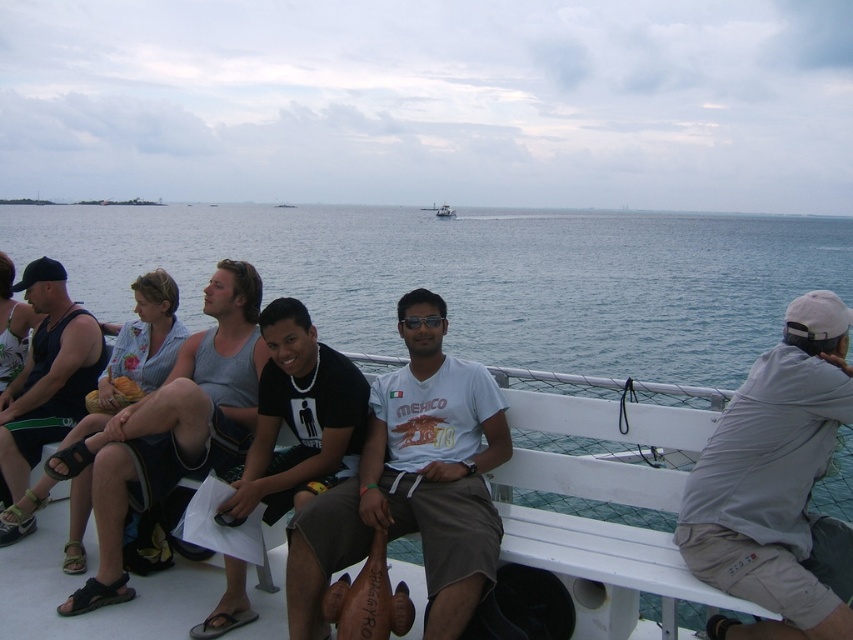
You are standing on the boat and want to know how far the point at coordinates point (122, 588) is from you. Can you determine the distance?

The distance of point (122, 588) from camera is 13.04 feet.

You are a photographer trying to capture a closeup of the white cotton shirt at center. What coordinates should you aim your camera at?

You should aim your camera at the coordinates point (412, 481) to capture the white cotton shirt at center.